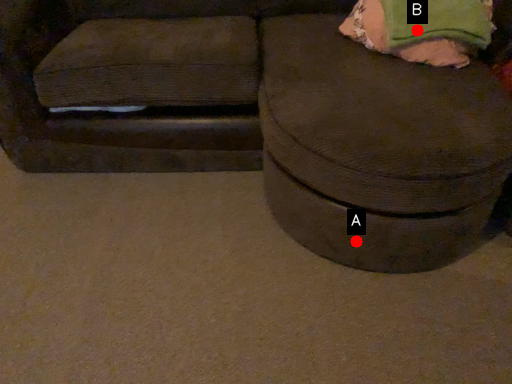
Question: Two points are circled on the image, labeled by A and B beside each circle. Which of the following is the closest to the observer?

Choices:
 (A) A is closer
 (B) B is closer

Answer: (A)